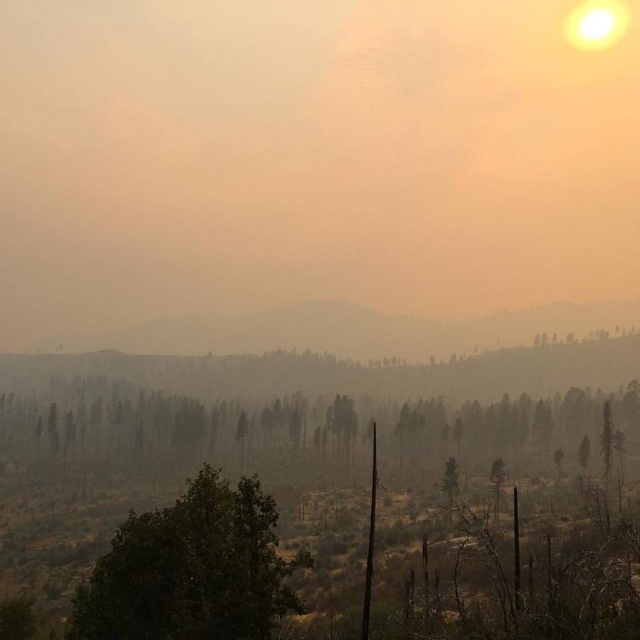
Question: Considering the relative positions of green matte trees at center and green leafy tree at center in the image provided, where is green matte trees at center located with respect to green leafy tree at center?

Choices:
 (A) left
 (B) right

Answer: (B)

Question: Which point is farther to the camera?

Choices:
 (A) (216, 582)
 (B) (28, 451)

Answer: (B)

Question: Is green matte trees at center below green leafy tree at center?

Choices:
 (A) yes
 (B) no

Answer: (B)

Question: Which point is farther to the camera?

Choices:
 (A) 214,582
 (B) 508,444

Answer: (B)

Question: Can you confirm if green matte trees at center is positioned to the right of green leafy tree at center?

Choices:
 (A) yes
 (B) no

Answer: (A)